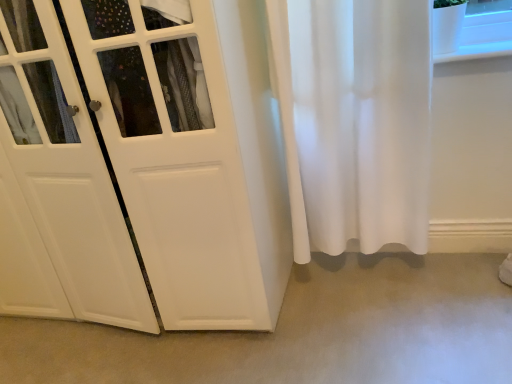
What do you see at coordinates (304, 332) in the screenshot? This screenshot has height=384, width=512. I see `beige carpet at lower center` at bounding box center [304, 332].

At what (x,y) coordinates should I click in order to perform the action: click on beige carpet at lower center. Please return your answer as a coordinate pair (x, y). The width and height of the screenshot is (512, 384). Looking at the image, I should click on (304, 332).

The width and height of the screenshot is (512, 384). Find the location of `white matte door at center`. white matte door at center is located at coordinates (151, 159).

This screenshot has width=512, height=384. What do you see at coordinates (151, 159) in the screenshot?
I see `white matte door at center` at bounding box center [151, 159].

I want to click on beige carpet at lower center, so click(x=304, y=332).

Considering the positions of objects beige carpet at lower center and white matte door at center in the image provided, who is more to the right, beige carpet at lower center or white matte door at center?

Positioned to the right is beige carpet at lower center.

Which object is further away from the camera taking this photo, beige carpet at lower center or white matte door at center?

beige carpet at lower center is further away from the camera.

Which is in front, point (34, 336) or point (135, 226)?

The point (135, 226) is in front.

From the image's perspective, between beige carpet at lower center and white matte door at center, which one is located above?

white matte door at center is shown above in the image.

From a real-world perspective, is beige carpet at lower center over white matte door at center?

Incorrect, from a real-world perspective, beige carpet at lower center is lower than white matte door at center.

Does beige carpet at lower center have a greater width compared to white matte door at center?

Yes.

Based on the photo, considering the sizes of beige carpet at lower center and white matte door at center in the image, is beige carpet at lower center taller or shorter than white matte door at center?

In the image, beige carpet at lower center appears to be shorter than white matte door at center.

Considering the sizes of objects beige carpet at lower center and white matte door at center in the image provided, who is smaller, beige carpet at lower center or white matte door at center?

With smaller size is beige carpet at lower center.

Would you say white matte door at center is part of beige carpet at lower center's contents?

That's incorrect, white matte door at center is not inside beige carpet at lower center.

Is beige carpet at lower center not near white matte door at center?

No, beige carpet at lower center is not far from white matte door at center.

Could you tell me if beige carpet at lower center is turned towards white matte door at center?

No, beige carpet at lower center is not turned towards white matte door at center.

How different are the orientations of beige carpet at lower center and white matte door at center in degrees?

The facing directions of beige carpet at lower center and white matte door at center are 1.16 degrees apart.

How distant is beige carpet at lower center from white matte door at center?

The distance of beige carpet at lower center from white matte door at center is 50.05 centimeters.

This screenshot has width=512, height=384. What are the coordinates of `concrete lying below the white matte door at center (from the image's perspective)` in the screenshot? It's located at (304, 332).

Considering the relative positions of white matte door at center and beige carpet at lower center in the image provided, is white matte door at center to the left of beige carpet at lower center from the viewer's perspective?

Yes.

Is white matte door at center in front of or behind beige carpet at lower center in the image?

Clearly, white matte door at center is in front of beige carpet at lower center.

Is point (14, 77) closer or farther from the camera than point (22, 367)?

Clearly, point (14, 77) is closer to the camera than point (22, 367).

From the image's perspective, is white matte door at center above or below beige carpet at lower center?

From the image's perspective, white matte door at center appears above beige carpet at lower center.

From a real-world perspective, between white matte door at center and beige carpet at lower center, who is vertically lower?

beige carpet at lower center.

Considering the relative sizes of white matte door at center and beige carpet at lower center in the image provided, is white matte door at center thinner than beige carpet at lower center?

Correct, the width of white matte door at center is less than that of beige carpet at lower center.

Can you confirm if white matte door at center is taller than beige carpet at lower center?

Indeed, white matte door at center has a greater height compared to beige carpet at lower center.

Which of these two, white matte door at center or beige carpet at lower center, is smaller?

Smaller between the two is beige carpet at lower center.

Is white matte door at center inside the boundaries of beige carpet at lower center, or outside?

white matte door at center exists outside the volume of beige carpet at lower center.

Is white matte door at center touching beige carpet at lower center?

No, white matte door at center is not making contact with beige carpet at lower center.

Is white matte door at center facing towards beige carpet at lower center?

No, white matte door at center does not turn towards beige carpet at lower center.

How many degrees apart are the facing directions of white matte door at center and beige carpet at lower center?

The angle between the facing direction of white matte door at center and the facing direction of beige carpet at lower center is 1.16 degrees.

How distant is white matte door at center from beige carpet at lower center?

19.70 inches.

Image resolution: width=512 pixels, height=384 pixels. In the image, there is a beige carpet at lower center. Find the location of `door above it (from the image's perspective)`. door above it (from the image's perspective) is located at coordinates (151, 159).

At what (x,y) coordinates should I click in order to perform the action: click on concrete below the white matte door at center (from a real-world perspective). Please return your answer as a coordinate pair (x, y). Looking at the image, I should click on (304, 332).

Where is `door above the beige carpet at lower center (from a real-world perspective)`? The image size is (512, 384). door above the beige carpet at lower center (from a real-world perspective) is located at coordinates (151, 159).